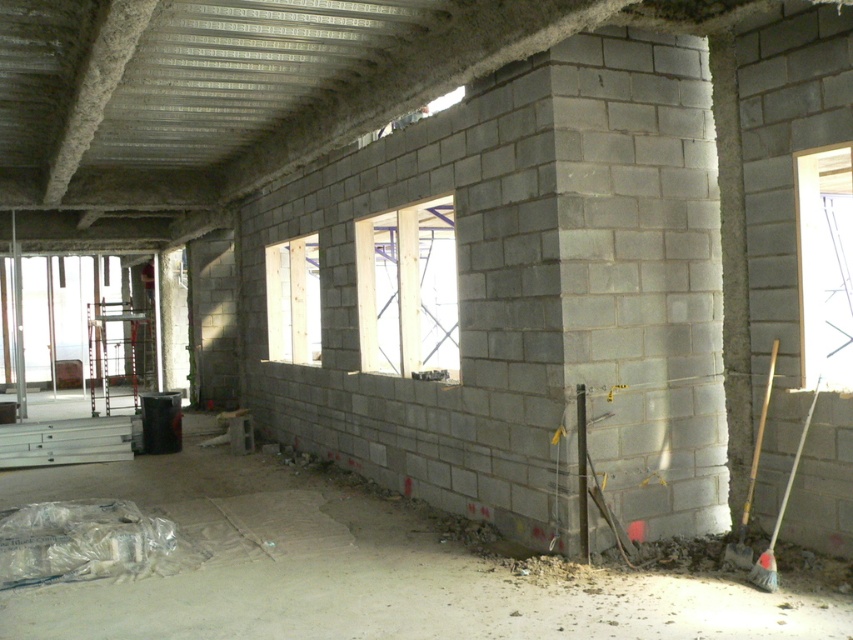
Question: Which of the following is the closest to the observer?

Choices:
 (A) (437, 609)
 (B) (785, 508)

Answer: (A)

Question: Can you confirm if wooden shovel at right is positioned to the right of wooden handle broom at lower right?

Choices:
 (A) no
 (B) yes

Answer: (A)

Question: Is gray concrete basement at lower center below light wood window at center?

Choices:
 (A) yes
 (B) no

Answer: (A)

Question: Can you confirm if transparent glass window at right is positioned to the left of wooden shovel at right?

Choices:
 (A) no
 (B) yes

Answer: (A)

Question: Which of these objects is positioned closest to the light wood window at center?

Choices:
 (A) gray concrete basement at lower center
 (B) clear wood window at center

Answer: (B)

Question: Which point appears closest to the camera in this image?

Choices:
 (A) (820, 157)
 (B) (309, 353)
 (C) (426, 321)

Answer: (A)